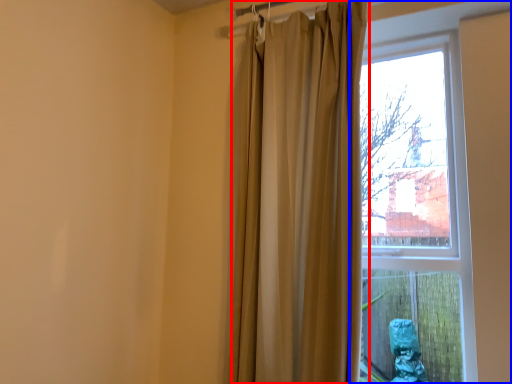
Question: Which object is closer to the camera taking this photo, curtain (highlighted by a red box) or window (highlighted by a blue box)?

Choices:
 (A) curtain
 (B) window

Answer: (B)